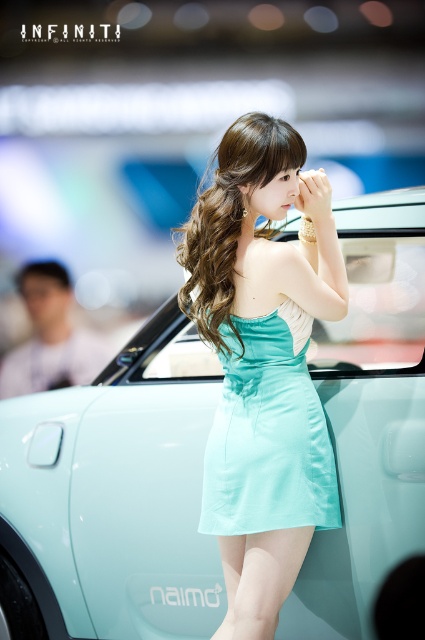
You are a photographer at an auto show. You want to take a photo of the light blue satin car at center and the teal satin dress at center. Which object should you focus on if you want the background to be more blurred?

The light blue satin car at center is bigger than the teal satin dress at center, so focusing on the light blue satin car at center will result in a more blurred background because larger objects typically require a smaller depth of field, which can lead to a more blurred background when in focus.

You are a photographer at the event and need to ensure both the teal satin dress at center and the mint satin dress at center are fully visible in the photo. Given that the camera frame can only accommodate a maximum width of 1.2 meters, will both dresses fit within the frame if placed side by side?

The teal satin dress at center is wider than the mint satin dress at center. If the total width of both dresses combined exceeds 1.2 meters, they won

You are a photographer standing at a distance. You want to take a photo of the teal satin dress at center. If your camera has a minimum focusing distance of 2 meters, will you need to move closer or farther away to ensure the dress is in focus?

The teal satin dress at center is 1.89 meters away from the viewer. Since the minimum focusing distance is 2 meters, you need to move farther away to ensure the dress is in focus.